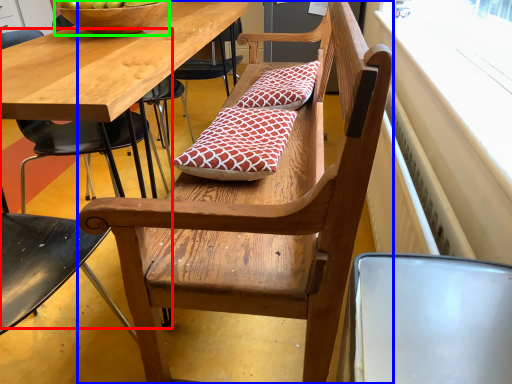
Question: Which object is the closest to the chair (highlighted by a red box)? Choose among these: bench (highlighted by a blue box) or bowl (highlighted by a green box).

Choices:
 (A) bench
 (B) bowl

Answer: (B)